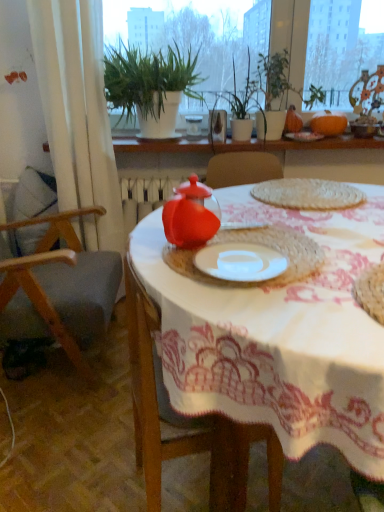
Where is `vacant space behind matte plastic teapot at center, placed as the 2th tableware when sorted from right to left`? The image size is (384, 512). vacant space behind matte plastic teapot at center, placed as the 2th tableware when sorted from right to left is located at coordinates (219, 221).